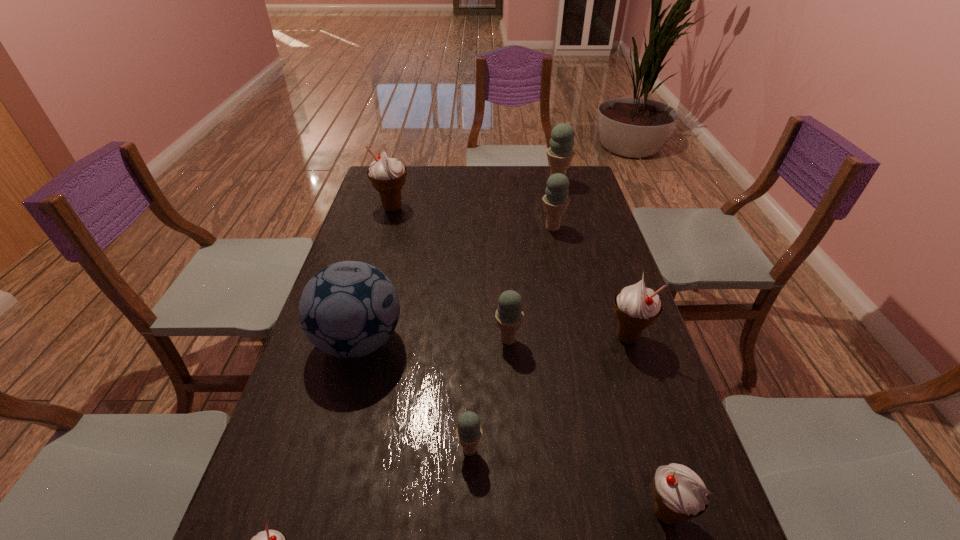
Find the location of a particular element. The image size is (960, 540). vacant space that's between the second smallest white icecream and the farthest white icecream is located at coordinates (529, 361).

In order to click on the fourth closest object relative to the third farthest white icecream in this screenshot , I will do `click(349, 309)`.

At what (x,y) coordinates should I click in order to perform the action: click on object that is the third closest to the fourth object from left to right. Please return your answer as a coordinate pair (x, y). Looking at the image, I should click on (680, 494).

Select which icecream appears as the fourth closest to the second farthest blue ice cream. Please provide its 2D coordinates. Your answer should be formatted as a tuple, i.e. [(x, y)], where the tuple contains the x and y coordinates of a point satisfying the conditions above.

[(387, 175)]

Identify the location of the fourth closest icecream to the biggest blue ice cream. Image resolution: width=960 pixels, height=540 pixels. (509, 315).

Select which blue ice cream is the second closest to the second farthest white icecream. Please provide its 2D coordinates. Your answer should be formatted as a tuple, i.e. [(x, y)], where the tuple contains the x and y coordinates of a point satisfying the conditions above.

[(468, 431)]

Where is `blue ice cream that is the closest to the second farthest white icecream`? Image resolution: width=960 pixels, height=540 pixels. blue ice cream that is the closest to the second farthest white icecream is located at coordinates (509, 315).

Locate an element on the screen. Image resolution: width=960 pixels, height=540 pixels. white icecream that stands as the third closest to the seventh farthest icecream is located at coordinates (387, 175).

Select which white icecream appears as the third closest to the soccer ball. Please provide its 2D coordinates. Your answer should be formatted as a tuple, i.e. [(x, y)], where the tuple contains the x and y coordinates of a point satisfying the conditions above.

[(636, 307)]

Identify the location of free region that satisfies the following two spatial constraints: 1. on the front side of the third nearest object; 2. on the right side of the third farthest white icecream. The width and height of the screenshot is (960, 540). (468, 514).